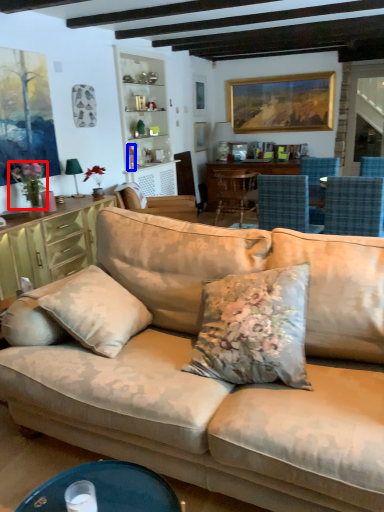
Question: Which point is further to the camera, flower (highlighted by a red box) or corded phone (highlighted by a blue box)?

Choices:
 (A) flower
 (B) corded phone

Answer: (B)